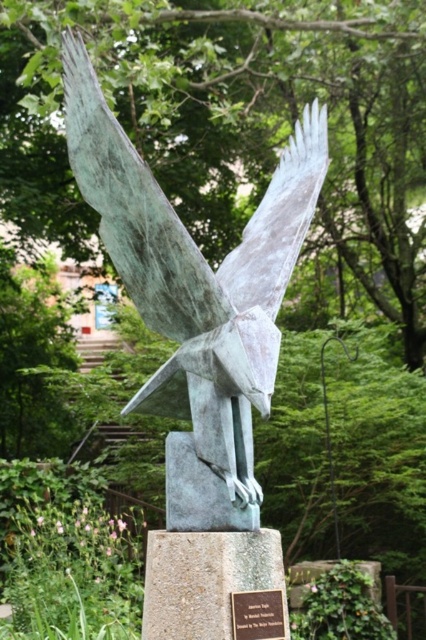
Between green patina eagle at center and bronze plaque at center, which one appears on the right side from the viewer's perspective?

bronze plaque at center

Does point (146, 406) lie in front of point (278, 620)?

No, (146, 406) is behind (278, 620).

Does point (302, 212) come behind point (244, 609)?

Yes, it is behind point (244, 609).

Where is `green patina eagle at center`? This screenshot has height=640, width=426. green patina eagle at center is located at coordinates (196, 298).